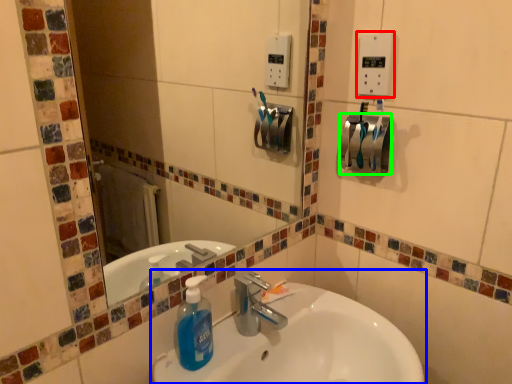
Question: Based on their relative distances, which object is nearer to light switch (highlighted by a red box)? Choose from sink (highlighted by a blue box) and towel bar (highlighted by a green box).

Choices:
 (A) sink
 (B) towel bar

Answer: (B)